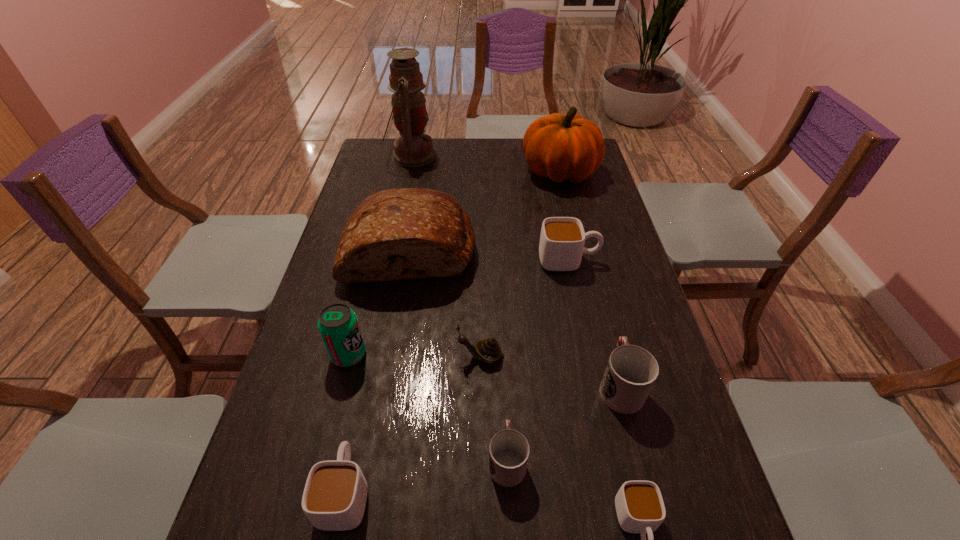
At what (x,y) coordinates should I click in order to perform the action: click on vacant space positioned on the handle side of the nearer red cup. Please return your answer as a coordinate pair (x, y). Looking at the image, I should click on (502, 336).

At what (x,y) coordinates should I click in order to perform the action: click on vacant position located 0.090m on the handle side of the nearer red cup. Please return your answer as a coordinate pair (x, y). Looking at the image, I should click on (504, 396).

Find the location of a particular element. oil lamp present at the far edge is located at coordinates (413, 148).

The image size is (960, 540). What are the coordinates of `pumpkin that is at the far edge` in the screenshot? It's located at (562, 147).

The height and width of the screenshot is (540, 960). I want to click on oil lamp at the left edge, so click(x=413, y=148).

The height and width of the screenshot is (540, 960). Identify the location of bread that is at the left edge. (406, 233).

This screenshot has width=960, height=540. In order to click on pop soda that is at the left edge in this screenshot , I will do `click(338, 325)`.

Where is `cup located at the left edge`? cup located at the left edge is located at coordinates (334, 498).

You are a GUI agent. You are given a task and a screenshot of the screen. Output one action in this format:
    pyautogui.click(x=<x>, y=<y>)
    Task: Click on the pumpkin that is at the right edge
    The image size is (960, 540).
    Given the screenshot: What is the action you would take?
    pyautogui.click(x=562, y=147)

Where is `object at the far left corner`? object at the far left corner is located at coordinates (413, 148).